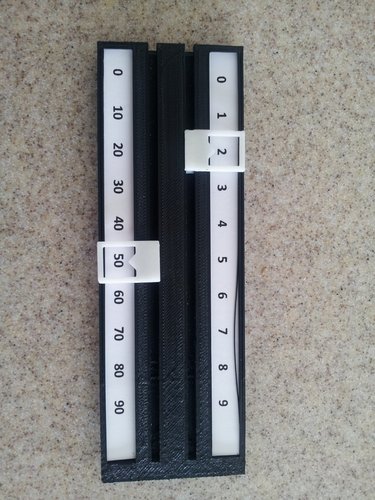
The image size is (375, 500). I want to click on flat surface, so click(50, 333).